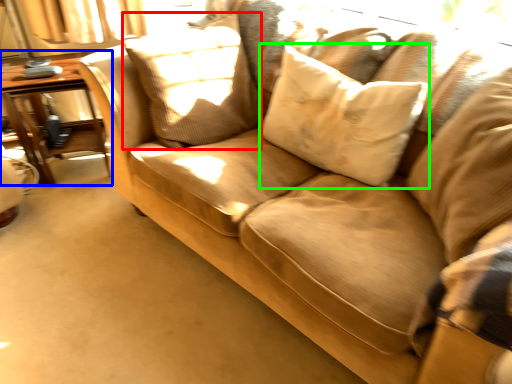
Question: Estimate the real-world distances between objects in this image. Which object is farther from pillow (highlighted by a red box), table (highlighted by a blue box) or pillow (highlighted by a green box)?

Choices:
 (A) table
 (B) pillow

Answer: (A)